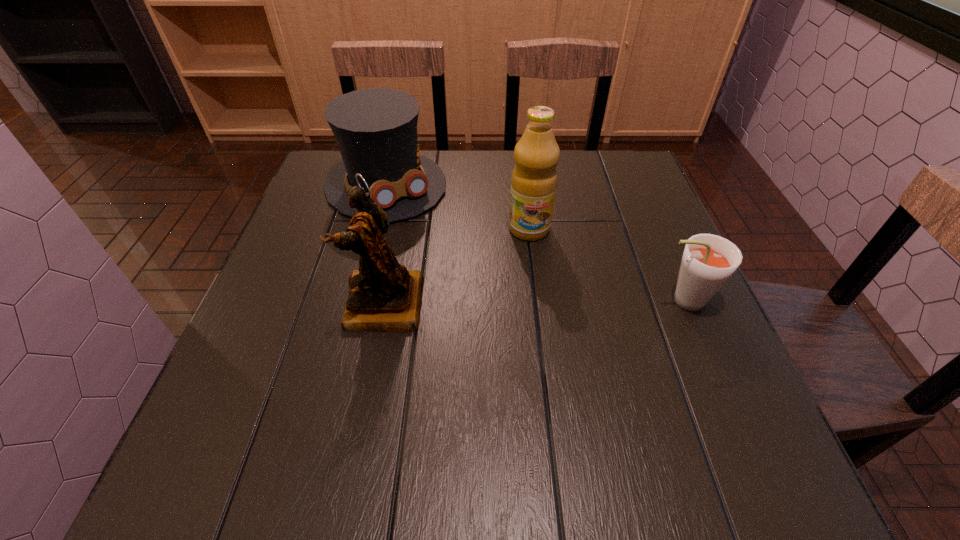
The height and width of the screenshot is (540, 960). I want to click on vacant space located 0.160m on the label of the olive oil, so click(541, 294).

Locate an element on the screen. The height and width of the screenshot is (540, 960). vacant region located 0.070m on the label of the olive oil is located at coordinates (536, 264).

Where is `free location located 0.250m with goggles on the front of the third tallest object`? The image size is (960, 540). free location located 0.250m with goggles on the front of the third tallest object is located at coordinates 467,279.

At what (x,y) coordinates should I click in order to perform the action: click on free space located with goggles on the front of the third tallest object. Please return your answer as a coordinate pair (x, y). This screenshot has width=960, height=540. Looking at the image, I should click on (448, 257).

The image size is (960, 540). Find the location of `free spot located 0.340m with goggles on the front of the third tallest object`. free spot located 0.340m with goggles on the front of the third tallest object is located at coordinates (491, 306).

The height and width of the screenshot is (540, 960). Identify the location of object that is at the far edge. (376, 129).

Where is `object present at the left edge`? object present at the left edge is located at coordinates (376, 129).

Image resolution: width=960 pixels, height=540 pixels. Find the location of `object positioned at the right edge`. object positioned at the right edge is located at coordinates pyautogui.click(x=708, y=261).

Where is `object at the far left corner`? object at the far left corner is located at coordinates (376, 129).

The width and height of the screenshot is (960, 540). In order to click on vacant point at the far edge in this screenshot , I will do `click(428, 157)`.